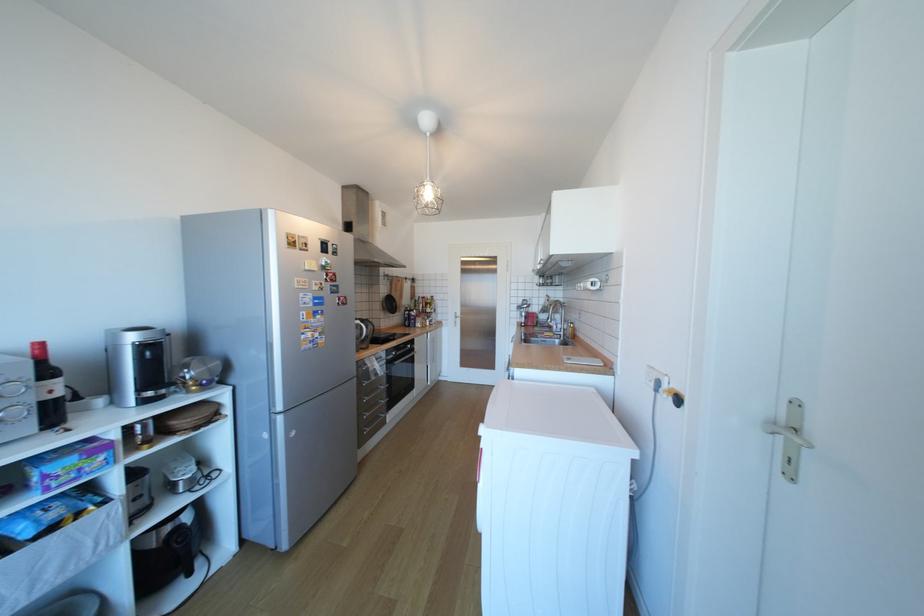
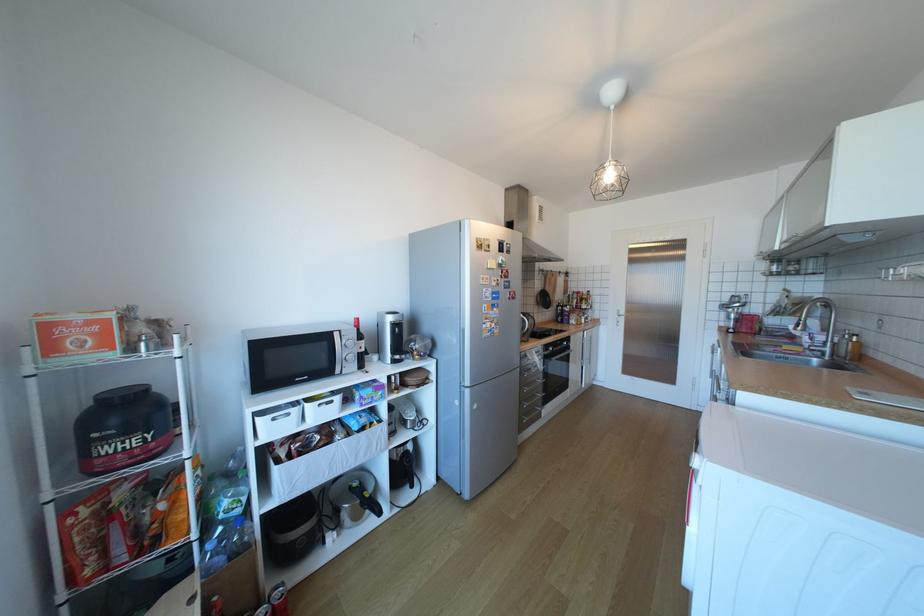
The point at (371, 321) is marked in the first image. Where is the corresponding point in the second image?

(532, 314)